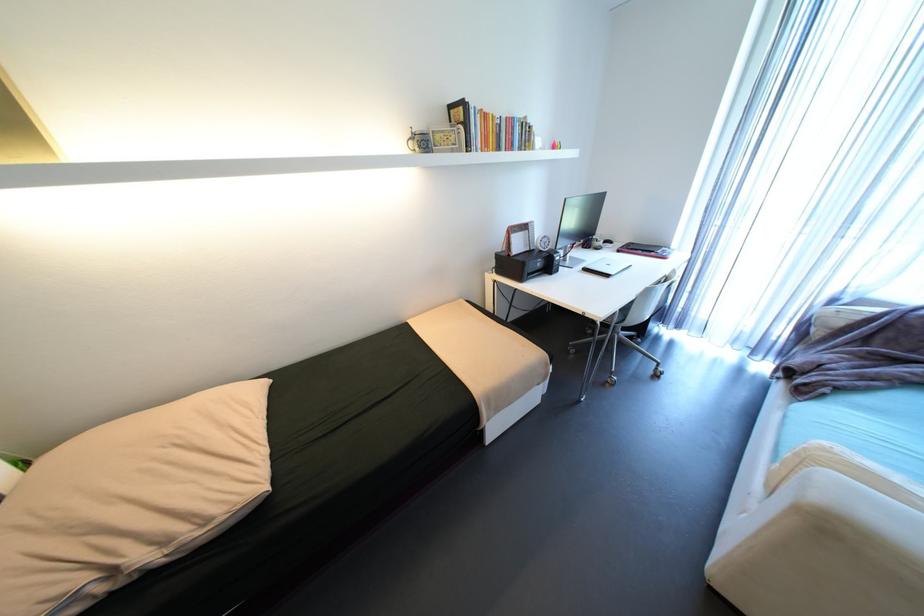
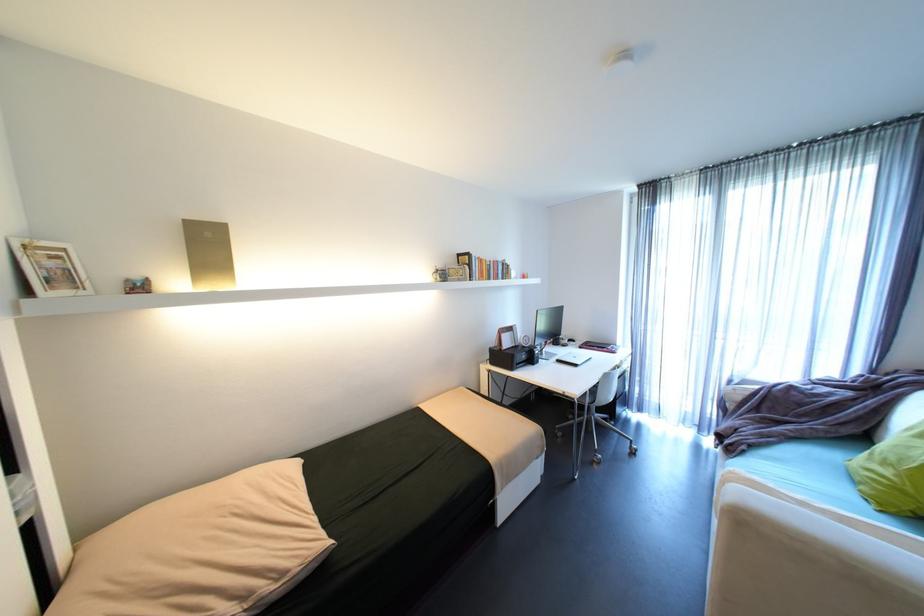
Where in the second image is the point corresponding to (573,199) from the first image?

(544, 310)